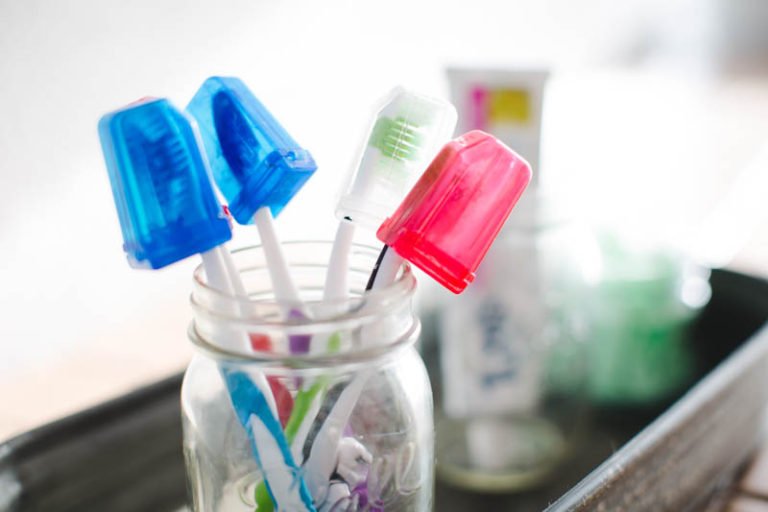
The height and width of the screenshot is (512, 768). Find the location of `glass mason jar`. glass mason jar is located at coordinates (391, 397).